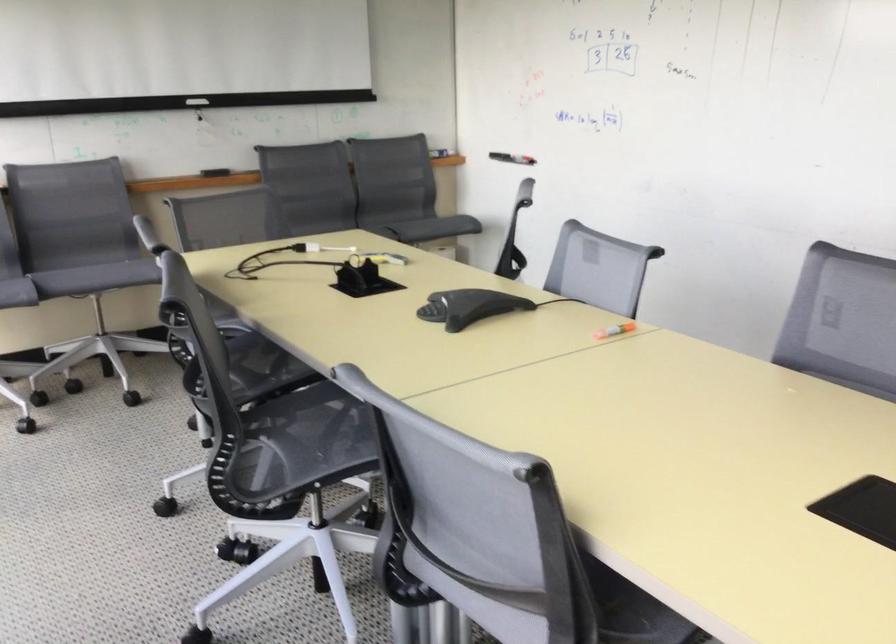
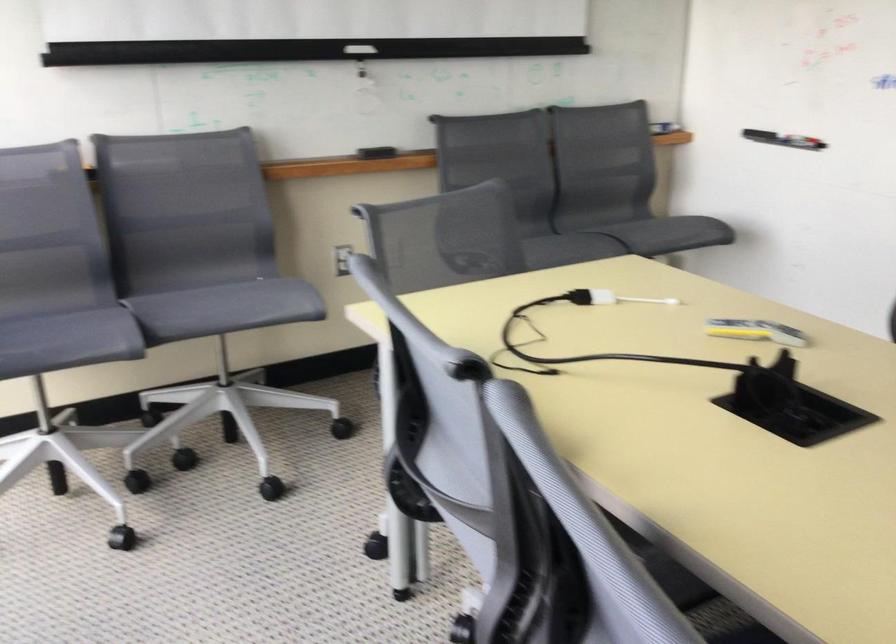
Locate, in the second image, the point that corresponds to point 196,98 in the first image.

(359, 49)